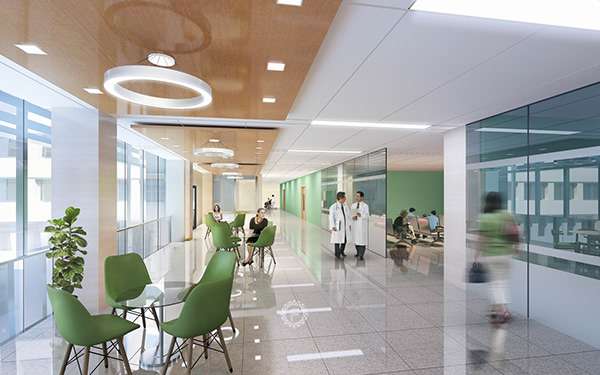
Identify the location of 10 chairs. (406, 244).